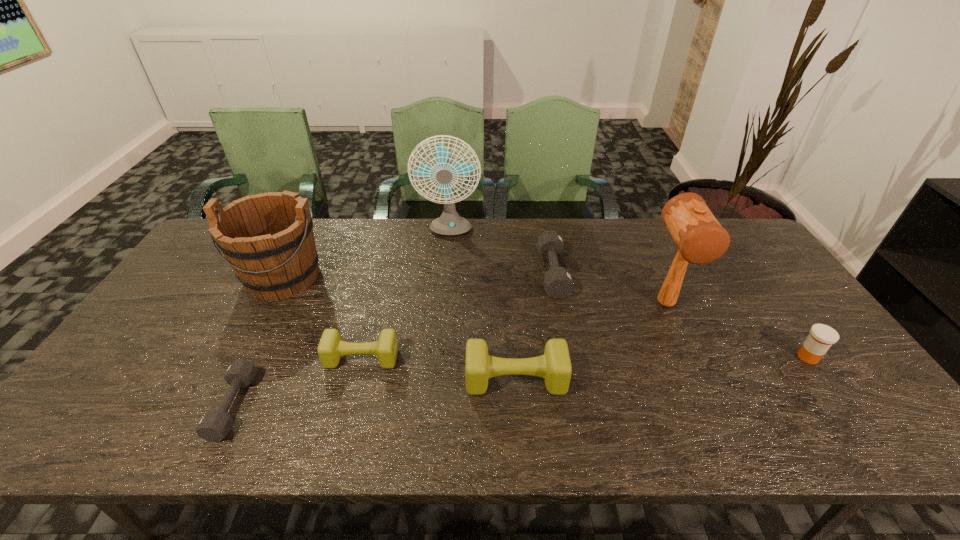
At what (x,y) coordinates should I click in order to perform the action: click on fan. Please return your answer as a coordinate pair (x, y). Image resolution: width=960 pixels, height=540 pixels. Looking at the image, I should click on (449, 223).

Find the location of a particular element. Image resolution: width=960 pixels, height=540 pixels. the farthest object is located at coordinates point(449,223).

You are a GUI agent. You are given a task and a screenshot of the screen. Output one action in this format:
    pyautogui.click(x=<x>, y=<y>)
    Task: Click on the mallet
    
    Given the screenshot: What is the action you would take?
    pyautogui.click(x=700, y=238)

You are a GUI agent. You are given a task and a screenshot of the screen. Output one action in this format:
    pyautogui.click(x=<x>, y=<y>)
    Task: Click on the wine bucket
    
    Given the screenshot: What is the action you would take?
    pyautogui.click(x=268, y=240)

I want to click on the right olive dumbbell, so click(x=554, y=366).

The height and width of the screenshot is (540, 960). Find the location of `the tallest dumbbell`. the tallest dumbbell is located at coordinates (554, 366).

Locate an element on the screen. Image resolution: width=960 pixels, height=540 pixels. the rightmost object is located at coordinates (821, 337).

What are the coordinates of `medicine` in the screenshot? It's located at (821, 337).

You are a GUI agent. You are given a task and a screenshot of the screen. Output one action in this format:
    pyautogui.click(x=<x>, y=<y>)
    Task: Click on the farthest dumbbell
    
    Given the screenshot: What is the action you would take?
    pyautogui.click(x=558, y=283)

Locate an element on the screen. the right gray dumbbell is located at coordinates (558, 283).